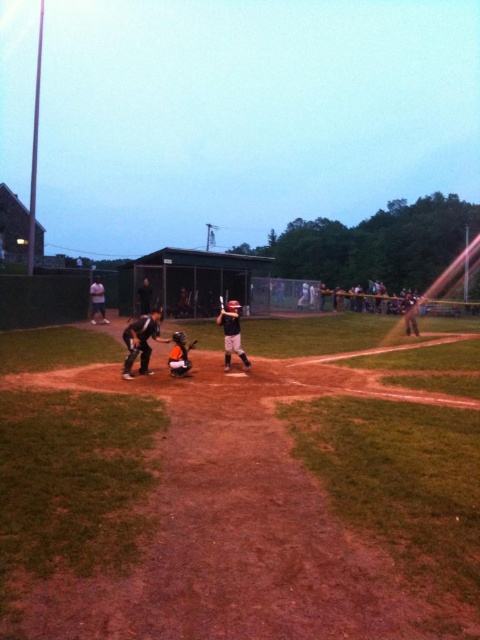
From the picture: You are a drone operator trying to capture aerial footage of the baseball game. You have two points marked on your screen for camera positioning. The first point is at coordinates point (136, 321) and the second point is at point (407, 305). Which point should you choose to get a closer shot of the action happening at home plate?

Point (136, 321) is closer to the viewer than point (407, 305), so choosing that point will provide a closer shot of the action at home plate.

Consider the image. You are a coach trying to decide which equipment to store first. Since the matte black bat at center and the orange jersey at center are both in the storage area, which one takes up more space in terms of width?

The orange jersey at center takes up more space in terms of width because the matte black bat at center is narrower than it.

You are a coach standing at the edge of the field. You notice a point marked at coordinates (231, 333). Which object is this point located on?

The point is located on the matte black bat at center.